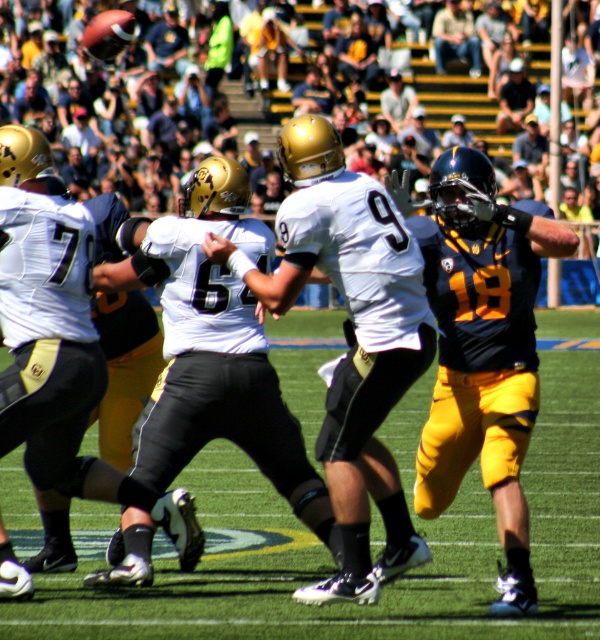
Question: Considering the real-world distances, which object is farthest from the dark blue jersey at center?

Choices:
 (A) white matte jersey at center
 (B) matte white jersey at center

Answer: (B)

Question: Does matte white jersey at center lie in front of white matte jersey at center?

Choices:
 (A) no
 (B) yes

Answer: (B)

Question: Is matte white jersey at center bigger than dark blue jersey at center?

Choices:
 (A) yes
 (B) no

Answer: (A)

Question: Which of the following is the farthest from the observer?

Choices:
 (A) (49, 246)
 (B) (433, 33)

Answer: (B)

Question: Does matte white jersey at center have a greater width compared to dark blue jersey at center?

Choices:
 (A) no
 (B) yes

Answer: (B)

Question: Which of the following is the closest to the observer?

Choices:
 (A) dark blue jersey at center
 (B) matte white jersey at center

Answer: (B)